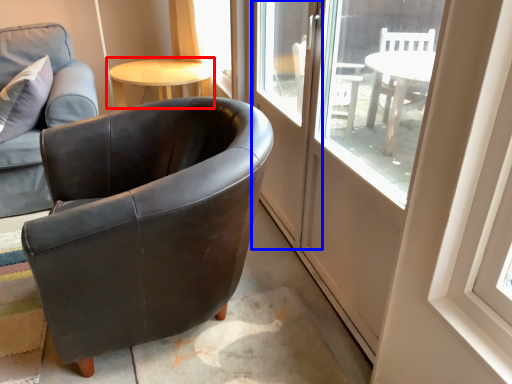
Question: Which point is further to the camera, table (highlighted by a red box) or screen door (highlighted by a blue box)?

Choices:
 (A) table
 (B) screen door

Answer: (A)